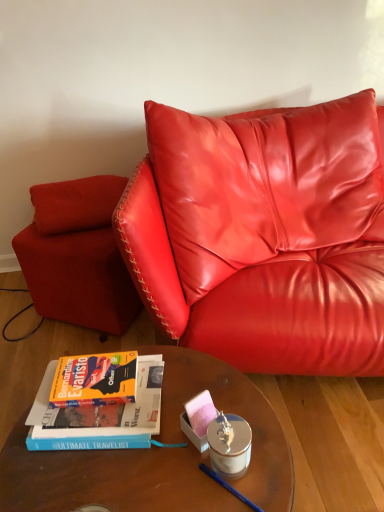
Where is `free space that is to the left of silver metallic candle holder at center`? Image resolution: width=384 pixels, height=512 pixels. free space that is to the left of silver metallic candle holder at center is located at coordinates (167, 468).